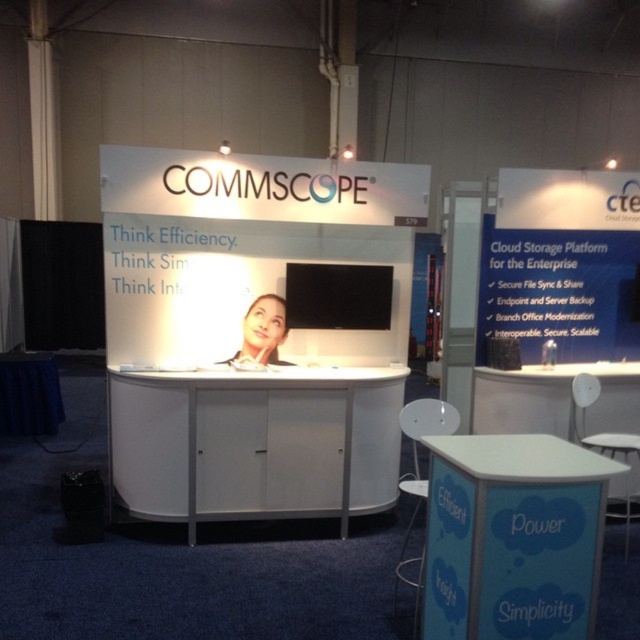
Question: Which object is positioned farthest from the white matte cabinet at center?

Choices:
 (A) smooth skin at center
 (B) white plastic table at center

Answer: (B)

Question: Is blue fabric table at lower right wider than smooth skin at center?

Choices:
 (A) yes
 (B) no

Answer: (A)

Question: Which object is closer to the camera taking this photo?

Choices:
 (A) blue fabric table at lower right
 (B) white matte cabinet at center
 (C) white plastic table at center
 (D) smooth skin at center

Answer: (A)

Question: Which of the following is the farthest from the observer?

Choices:
 (A) (634, 419)
 (B) (499, 474)

Answer: (A)

Question: Is white matte cabinet at center above blue fabric table at lower right?

Choices:
 (A) yes
 (B) no

Answer: (A)

Question: Does white matte cabinet at center appear on the left side of blue fabric table at lower right?

Choices:
 (A) no
 (B) yes

Answer: (B)